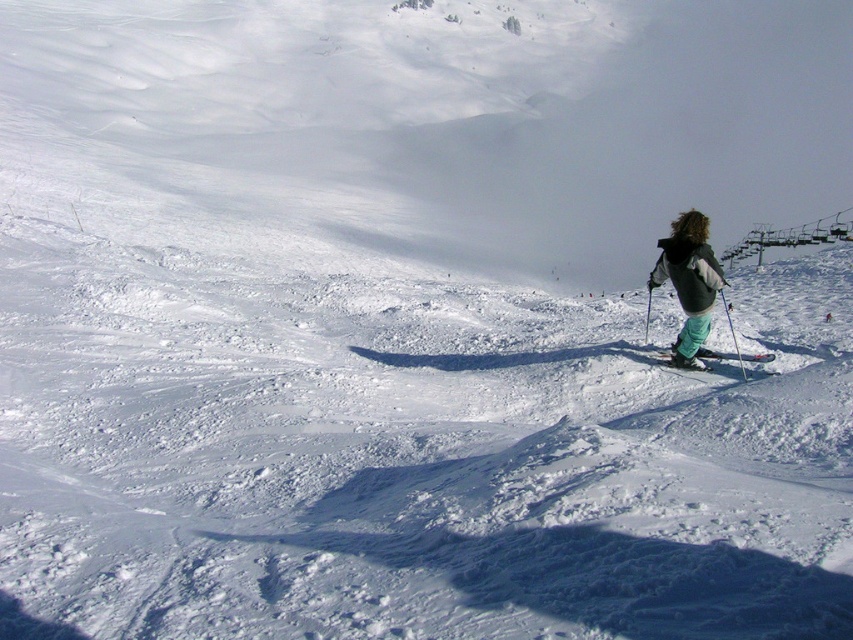
Question: Which of the following is the closest to the observer?

Choices:
 (A) teal fabric pants at right
 (B) green fabric ski at center

Answer: (A)

Question: Which point is closer to the camera?

Choices:
 (A) metallic gray ski lift at upper right
 (B) teal fabric pants at right
 (C) green fabric ski at center

Answer: (B)

Question: Considering the real-world distances, which object is farthest from the metallic gray ski lift at upper right?

Choices:
 (A) green fabric ski at center
 (B) teal fabric pants at right

Answer: (B)

Question: Can you confirm if metallic gray ski lift at upper right is bigger than green fabric ski at center?

Choices:
 (A) yes
 (B) no

Answer: (A)

Question: Does metallic gray ski lift at upper right appear over green fabric ski at center?

Choices:
 (A) yes
 (B) no

Answer: (A)

Question: Can you confirm if teal fabric pants at right is positioned below metallic gray ski lift at upper right?

Choices:
 (A) no
 (B) yes

Answer: (B)